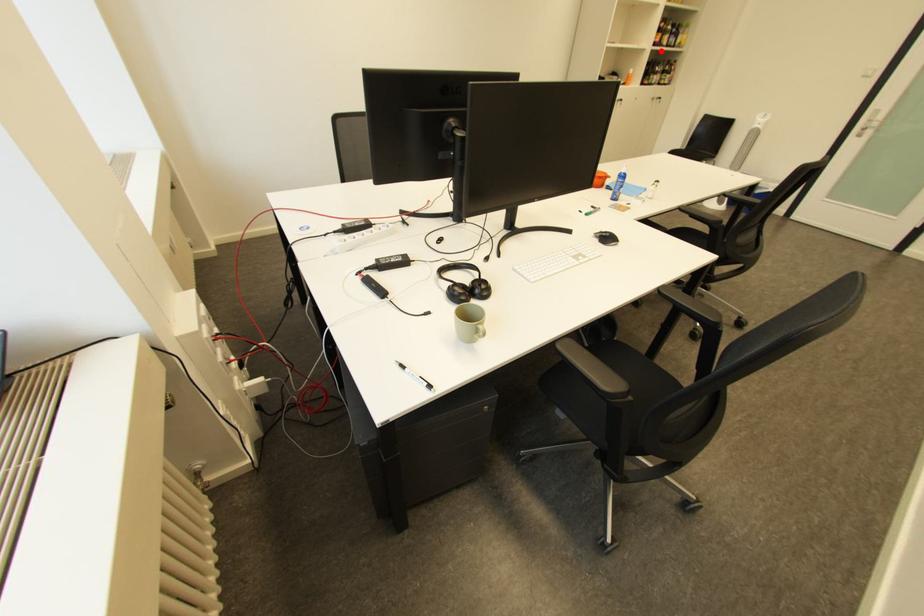
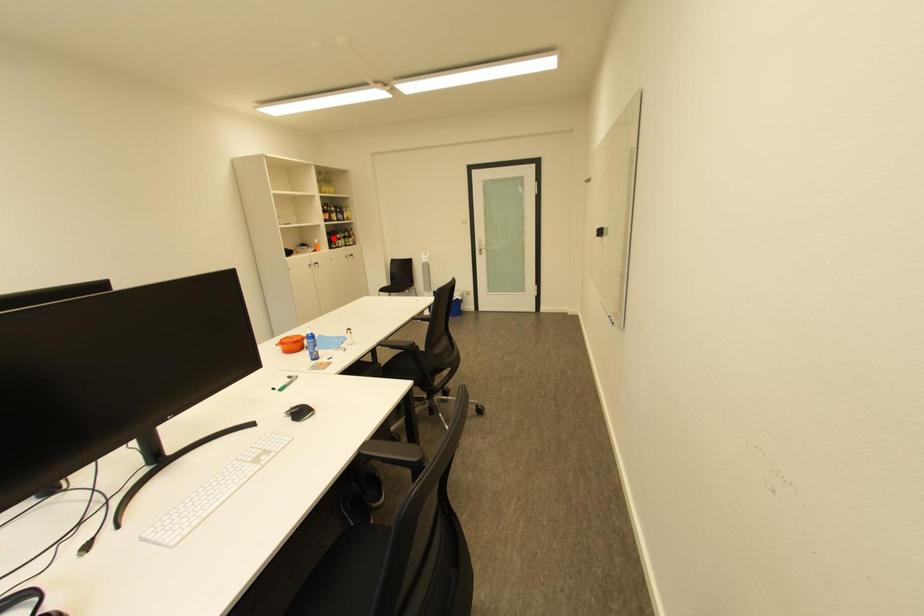
I am providing you with two images of the same scene from different viewpoints. A red point is marked on the first image and another point is marked on the second image. Are the points marked in image1 and image2 representing the same 3D position?

No